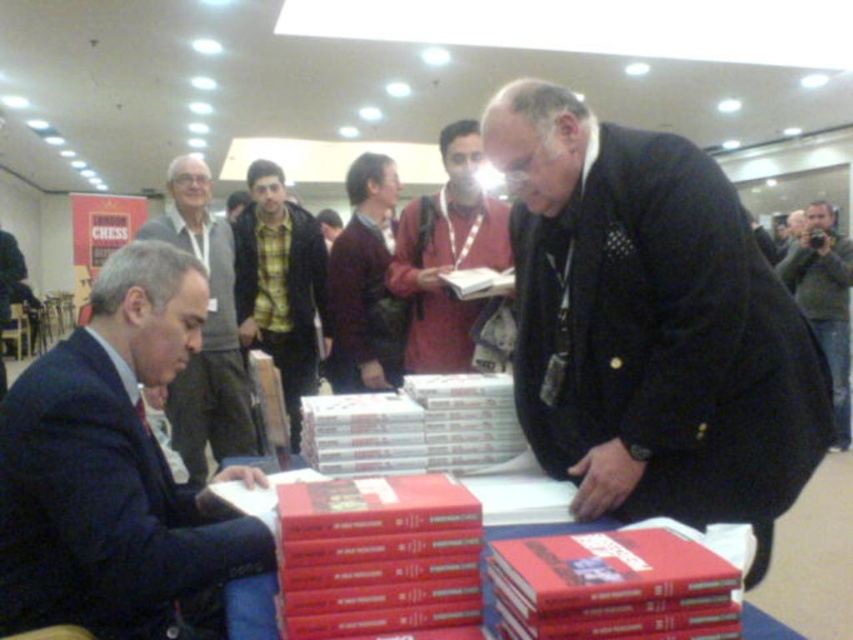
Describe the element at coordinates (111, 467) in the screenshot. I see `dark blue suit at left` at that location.

At what (x,y) coordinates should I click in order to perform the action: click on dark blue suit at left. Please return your answer as a coordinate pair (x, y). The image size is (853, 640). Looking at the image, I should click on (111, 467).

Which is more to the right, yellow-green shirt at center or green textured sweater at upper right?

From the viewer's perspective, green textured sweater at upper right appears more on the right side.

Does yellow-green shirt at center have a lesser width compared to green textured sweater at upper right?

Yes, yellow-green shirt at center is thinner than green textured sweater at upper right.

The height and width of the screenshot is (640, 853). I want to click on yellow-green shirt at center, so click(281, 285).

Is matte red jacket at center to the left of maroon sweater at center from the viewer's perspective?

In fact, matte red jacket at center is to the right of maroon sweater at center.

What do you see at coordinates (447, 253) in the screenshot?
I see `matte red jacket at center` at bounding box center [447, 253].

You are a GUI agent. You are given a task and a screenshot of the screen. Output one action in this format:
    pyautogui.click(x=<x>, y=<y>)
    Task: Click on the matte red jacket at center
    This screenshot has width=853, height=640.
    Given the screenshot: What is the action you would take?
    pyautogui.click(x=447, y=253)

Locate an element on the screen. matte red jacket at center is located at coordinates (447, 253).